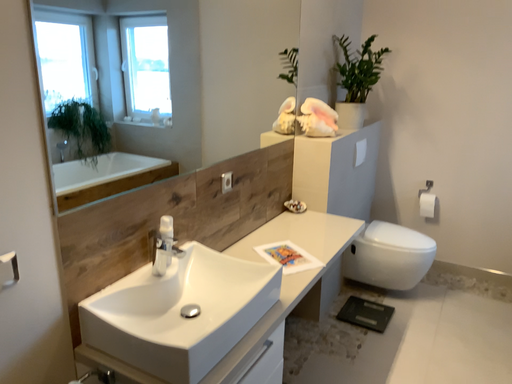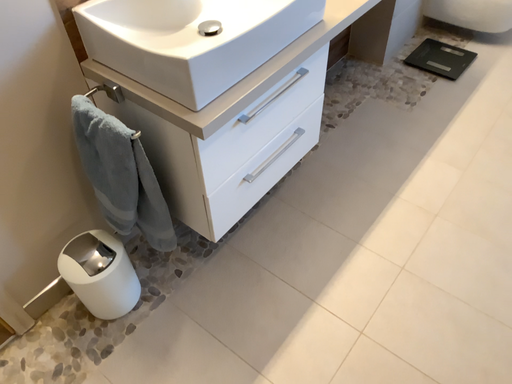
Question: How did the camera likely rotate when shooting the video?

Choices:
 (A) rotated left
 (B) rotated right

Answer: (A)